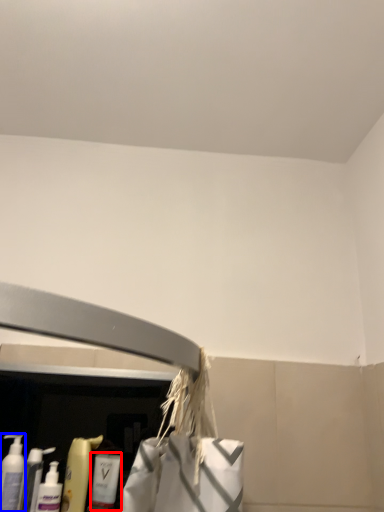
Question: Which object appears closest to the camera in this image, cleaning product (highlighted by a red box) or cleaning product (highlighted by a blue box)?

Choices:
 (A) cleaning product
 (B) cleaning product

Answer: (B)